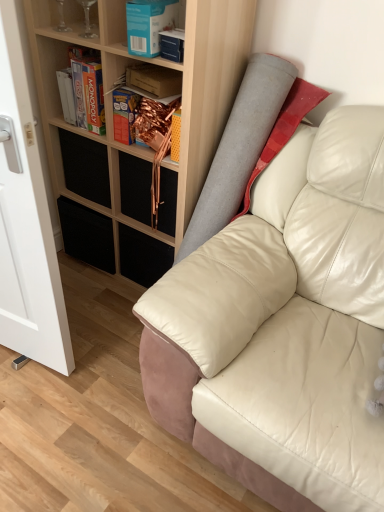
Locate an element on the screen. vacant area on the back side of white glossy glass door at left is located at coordinates (87, 300).